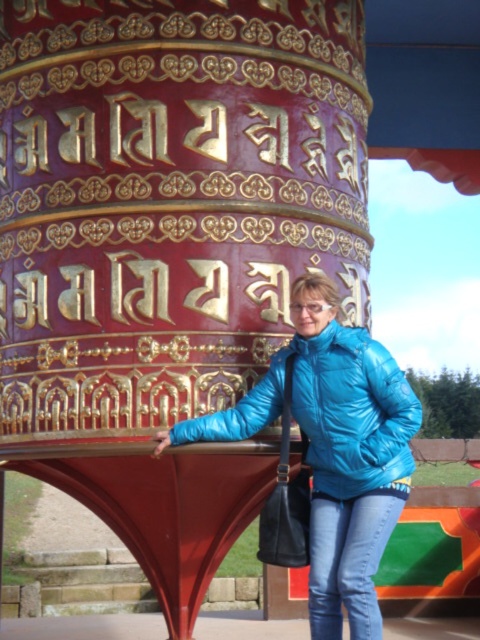
Question: Which point is farther to the camera?

Choices:
 (A) (325, 403)
 (B) (407, 461)

Answer: (B)

Question: From the image, what is the correct spatial relationship of blue glossy jacket at center in relation to blue shiny jacket at center?

Choices:
 (A) right
 (B) left

Answer: (B)

Question: Where is blue glossy jacket at center located in relation to blue shiny jacket at center in the image?

Choices:
 (A) above
 (B) below

Answer: (B)

Question: Which object appears farthest from the camera in this image?

Choices:
 (A) blue glossy jacket at center
 (B) blue shiny jacket at center

Answer: (B)

Question: Does blue glossy jacket at center have a larger size compared to blue shiny jacket at center?

Choices:
 (A) yes
 (B) no

Answer: (A)